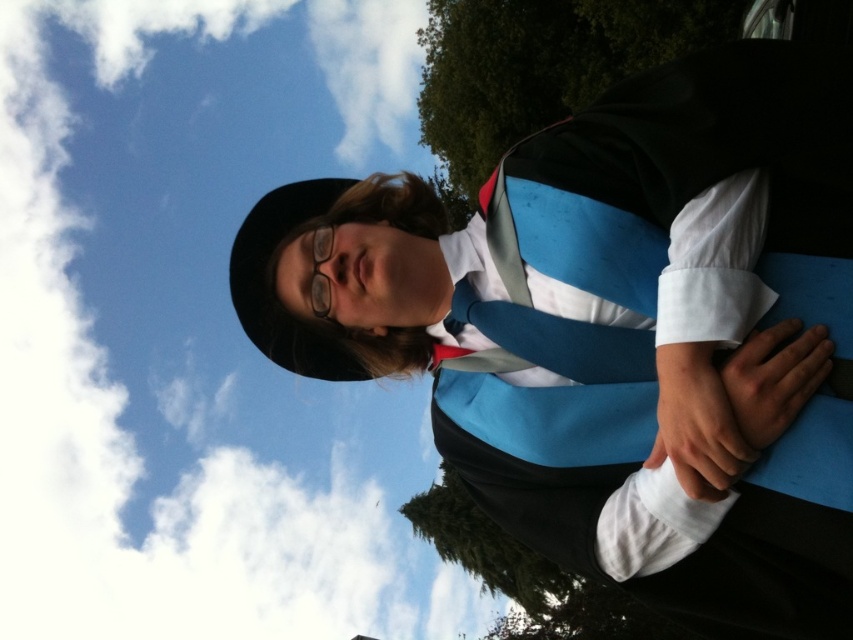
You are a photographer taking a portrait of the graduate. You notice two green leafy trees in the background. Which tree, the green leafy tree at center or the green leafy tree at upper center, appears bigger in the photo?

The green leafy tree at center appears bigger in the photo because it has a larger size compared to the green leafy tree at upper center.

Based on the scene description, which tree, the green leafy tree at center or the green leafy tree at upper center, has a larger width?

The green leafy tree at center might be wider than the green leafy tree at upper center according to the description.